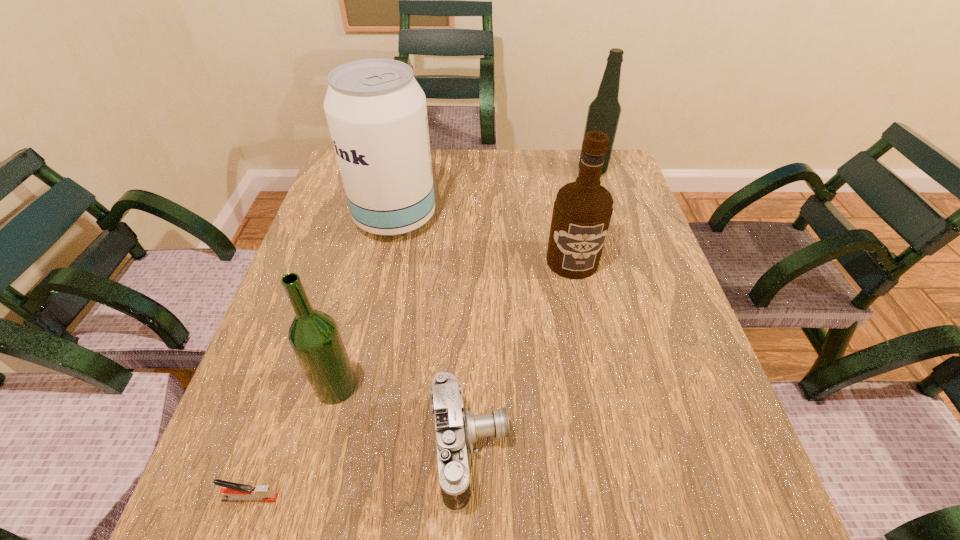
I want to click on the fourth closest object to the camera, so click(376, 111).

The height and width of the screenshot is (540, 960). Find the location of `the second closest object relative to the third object from right to left`. the second closest object relative to the third object from right to left is located at coordinates (233, 491).

I want to click on alcohol that is the nearest to the rightmost object, so click(x=582, y=211).

At what (x,y) coordinates should I click in order to perform the action: click on alcohol that is the nearest to the second object from right to left. Please return your answer as a coordinate pair (x, y). This screenshot has width=960, height=540. Looking at the image, I should click on (376, 111).

Identify the location of vacant point that satisfies the following two spatial constraints: 1. on the label of the second object from right to left; 2. on the handle side of the shortest object. Image resolution: width=960 pixels, height=540 pixels. (622, 498).